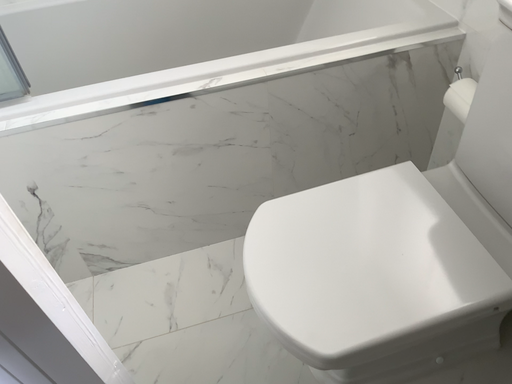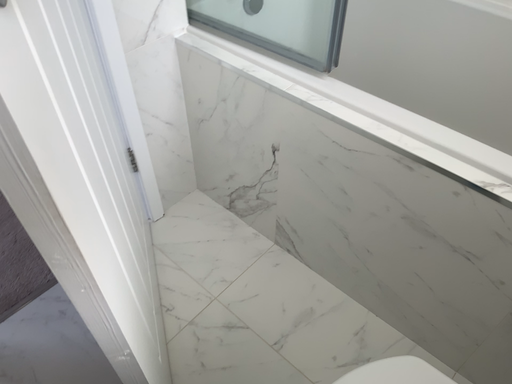
Question: How did the camera likely rotate when shooting the video?

Choices:
 (A) rotated downward
 (B) rotated upward

Answer: (B)